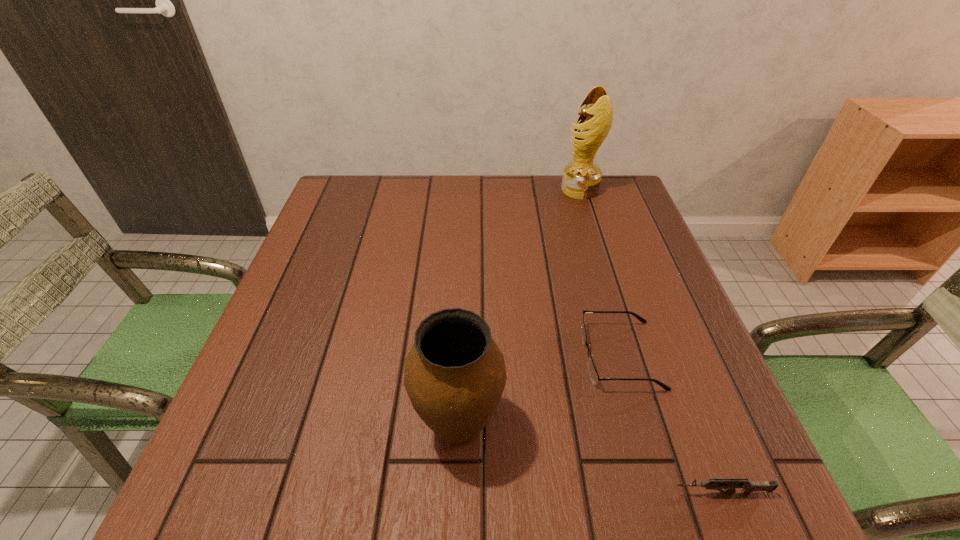
The image size is (960, 540). I want to click on vacant space that is in between the spectacles and the award, so click(x=600, y=272).

Select which object is the closest to the award. Please provide its 2D coordinates. Your answer should be formatted as a tuple, i.e. [(x, y)], where the tuple contains the x and y coordinates of a point satisfying the conditions above.

[(593, 373)]

Locate which object ranks in proximity to the second tallest object. Please provide its 2D coordinates. Your answer should be formatted as a tuple, i.e. [(x, y)], where the tuple contains the x and y coordinates of a point satisfying the conditions above.

[(593, 373)]

You are a GUI agent. You are given a task and a screenshot of the screen. Output one action in this format:
    pyautogui.click(x=<x>, y=<y>)
    Task: Click on the free spot that satisfies the following two spatial constraints: 1. on the front-facing side of the tallest object; 2. on the front side of the urn
    The width and height of the screenshot is (960, 540).
    Given the screenshot: What is the action you would take?
    pyautogui.click(x=653, y=427)